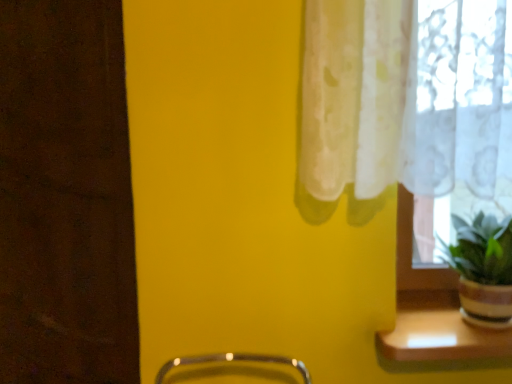
Question: Is wooden shelf at lower right to the left or to the right of green matte plant at right in the image?

Choices:
 (A) left
 (B) right

Answer: (A)

Question: Considering the positions of wooden shelf at lower right and green matte plant at right in the image, is wooden shelf at lower right wider or thinner than green matte plant at right?

Choices:
 (A) thin
 (B) wide

Answer: (A)

Question: Relative to green matte plant at right, is wooden shelf at lower right in front or behind?

Choices:
 (A) front
 (B) behind

Answer: (B)

Question: Considering the positions of green matte plant at right and wooden shelf at lower right in the image, is green matte plant at right bigger or smaller than wooden shelf at lower right?

Choices:
 (A) big
 (B) small

Answer: (A)

Question: From the image's perspective, is green matte plant at right positioned above or below wooden shelf at lower right?

Choices:
 (A) below
 (B) above

Answer: (B)

Question: From their relative heights in the image, would you say green matte plant at right is taller or shorter than wooden shelf at lower right?

Choices:
 (A) short
 (B) tall

Answer: (B)

Question: In terms of width, does green matte plant at right look wider or thinner when compared to wooden shelf at lower right?

Choices:
 (A) thin
 (B) wide

Answer: (B)